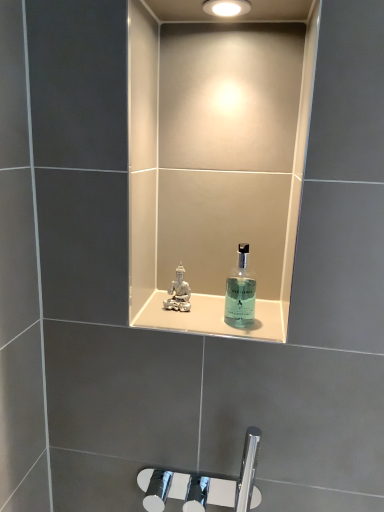
Question: From a real-world perspective, does translucent glass shelf at center stand above matte white light fixture at upper center?

Choices:
 (A) no
 (B) yes

Answer: (A)

Question: Can you confirm if translucent glass shelf at center is bigger than matte white light fixture at upper center?

Choices:
 (A) yes
 (B) no

Answer: (A)

Question: Is matte white light fixture at upper center inside translucent glass shelf at center?

Choices:
 (A) yes
 (B) no

Answer: (B)

Question: From the image's perspective, is translucent glass shelf at center on matte white light fixture at upper center?

Choices:
 (A) no
 (B) yes

Answer: (A)

Question: Could you tell me if translucent glass shelf at center is facing matte white light fixture at upper center?

Choices:
 (A) yes
 (B) no

Answer: (B)

Question: Would you say translucent glass shelf at center is outside matte white light fixture at upper center?

Choices:
 (A) no
 (B) yes

Answer: (B)

Question: Does translucent glass shelf at center come in front of transparent glass bottle at center?

Choices:
 (A) yes
 (B) no

Answer: (B)

Question: From the image's perspective, would you say translucent glass shelf at center is shown under transparent glass bottle at center?

Choices:
 (A) yes
 (B) no

Answer: (A)

Question: From the image's perspective, is translucent glass shelf at center over transparent glass bottle at center?

Choices:
 (A) yes
 (B) no

Answer: (B)

Question: From a real-world perspective, is translucent glass shelf at center physically below transparent glass bottle at center?

Choices:
 (A) yes
 (B) no

Answer: (A)

Question: Is translucent glass shelf at center to the left of transparent glass bottle at center from the viewer's perspective?

Choices:
 (A) no
 (B) yes

Answer: (B)

Question: Does translucent glass shelf at center have a lesser height compared to transparent glass bottle at center?

Choices:
 (A) no
 (B) yes

Answer: (B)

Question: Can you confirm if transparent glass bottle at center is wider than translucent glass shelf at center?

Choices:
 (A) yes
 (B) no

Answer: (B)